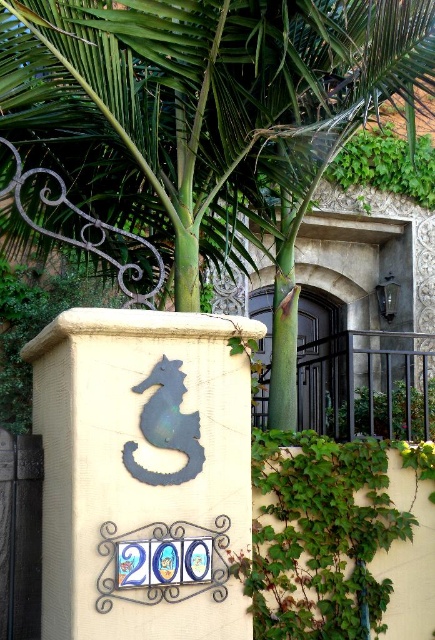
What are the coordinates of the green leafy palm tree at center?

The green leafy palm tree at center is located at coordinates point (210, 115).

You are standing in front of the entrance and see the green leafy palm tree at center and the black wrought iron gate at center. Which one is more to the left?

The green leafy palm tree at center is more to the left side of the black wrought iron gate at center.